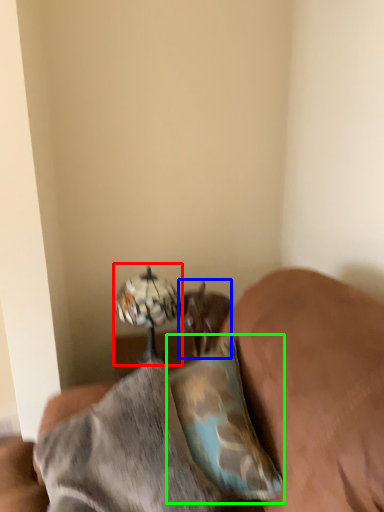
Question: Which is nearer to the table lamp (highlighted by a red box)? animal (highlighted by a blue box) or pillow (highlighted by a green box).

Choices:
 (A) animal
 (B) pillow

Answer: (A)